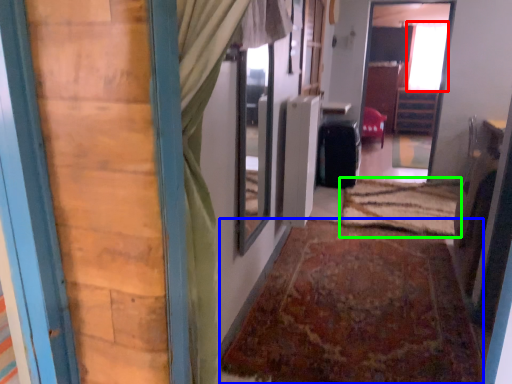
Question: Which object is the farthest from window (highlighted by a red box)? Choose among these: doormat (highlighted by a blue box) or doormat (highlighted by a green box).

Choices:
 (A) doormat
 (B) doormat

Answer: (A)